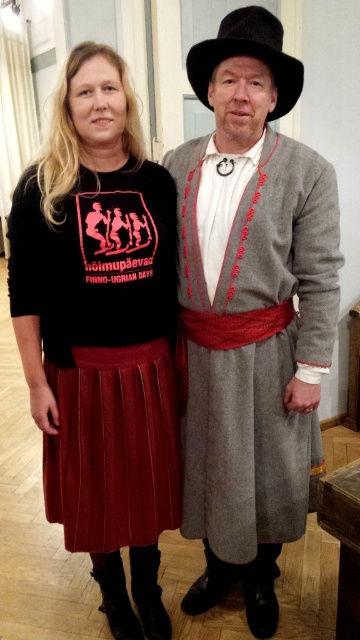
Can you confirm if velvet skirt at center is shorter than black felt cowboy hat at upper center?

No, velvet skirt at center is not shorter than black felt cowboy hat at upper center.

Which is more to the left, velvet skirt at center or black felt cowboy hat at upper center?

velvet skirt at center

The width and height of the screenshot is (360, 640). I want to click on velvet skirt at center, so pos(101,332).

In the scene shown: Does burgundy pleated skirt at lower left lie behind black felt cowboy hat at upper center?

Yes, burgundy pleated skirt at lower left is behind black felt cowboy hat at upper center.

Does burgundy pleated skirt at lower left have a lesser width compared to black felt cowboy hat at upper center?

In fact, burgundy pleated skirt at lower left might be wider than black felt cowboy hat at upper center.

Does point (114, 522) lie in front of point (221, 20)?

That is True.

Locate an element on the screen. burgundy pleated skirt at lower left is located at coordinates (114, 448).

How distant is velvet skirt at center from burgundy pleated skirt at lower left?

velvet skirt at center is 7.81 centimeters away from burgundy pleated skirt at lower left.

Is velvet skirt at center taller than burgundy pleated skirt at lower left?

Correct, velvet skirt at center is much taller as burgundy pleated skirt at lower left.

This screenshot has width=360, height=640. Describe the element at coordinates (101, 332) in the screenshot. I see `velvet skirt at center` at that location.

Image resolution: width=360 pixels, height=640 pixels. In order to click on velvet skirt at center in this screenshot , I will do `click(101, 332)`.